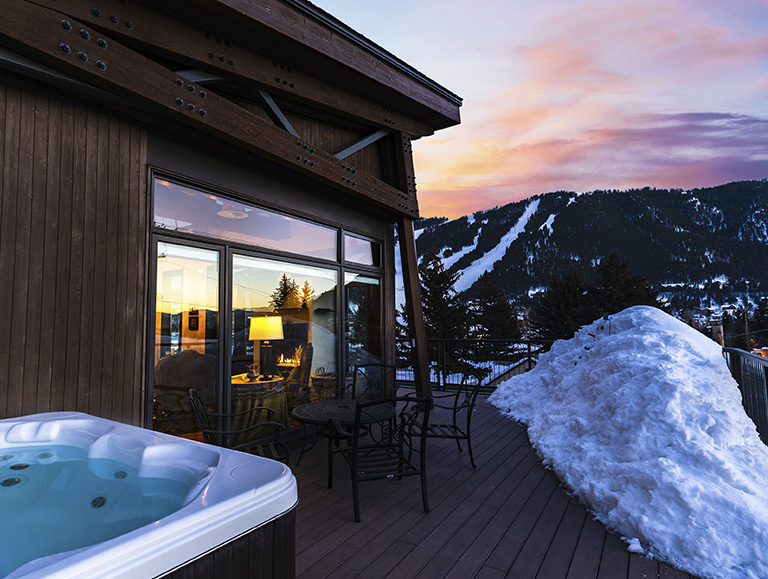
Locate an element on the screen. lamp is located at coordinates (263, 335).